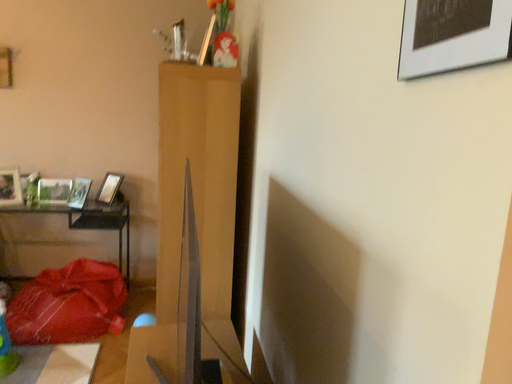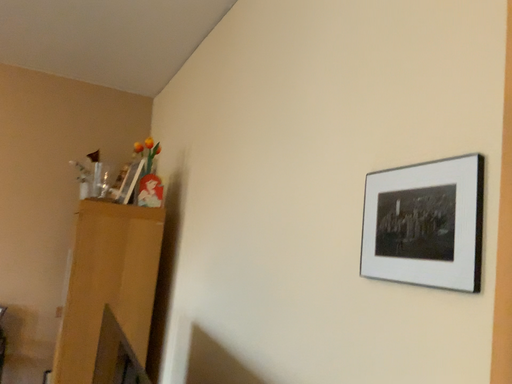
Question: Which way did the camera rotate in the video?

Choices:
 (A) rotated downward
 (B) rotated upward

Answer: (B)